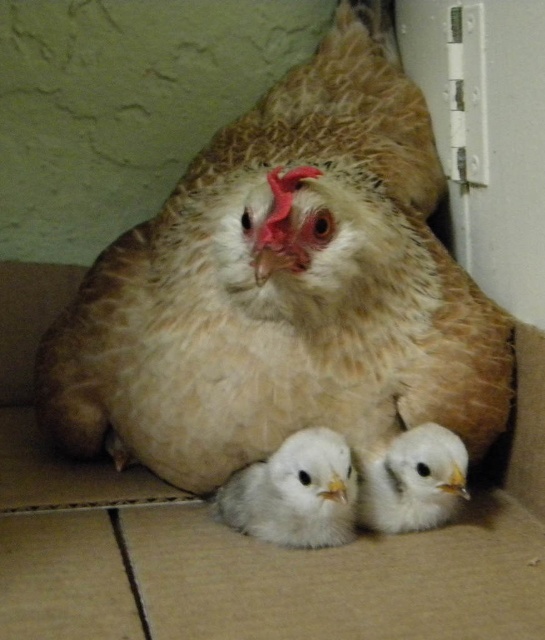
You are a small toy that needs to hide behind an object in the scene. The brown cardboard box at center and the white fluffy chick at center are available. Which object should you choose to hide behind?

The brown cardboard box at center has a larger size compared to the white fluffy chick at center, so you should hide behind the brown cardboard box at center.

You are a farmer checking the hen and her chicks. The hen is at the center. Where exactly is the brown textured chicken at center positioned in the image coordinates?

The brown textured chicken at center is located at point (283, 289).

You are a small toy that needs to hide under the brown cardboard box at center to avoid being seen by a curious cat. Can the white fluffy chick at center also hide under the same box without being exposed?

The brown cardboard box at center is taller than the white fluffy chick at center, so yes, the white fluffy chick at center can hide under the brown cardboard box at center without being exposed.